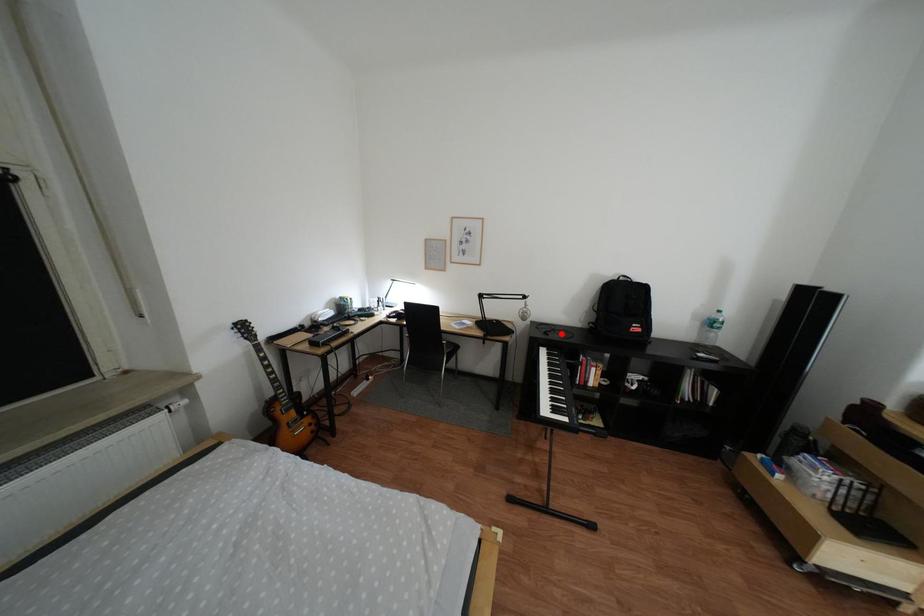
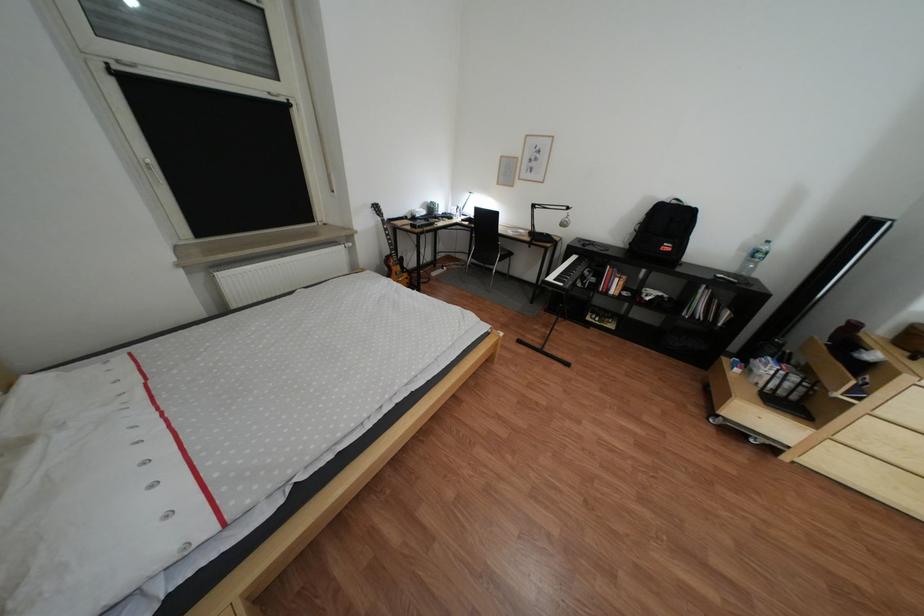
The point at the highlighted location is marked in the first image. Where is the corresponding point in the second image?

(600, 246)